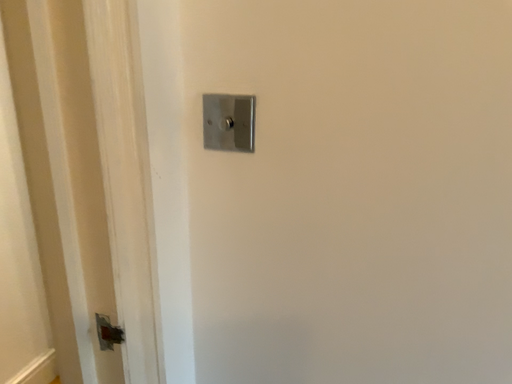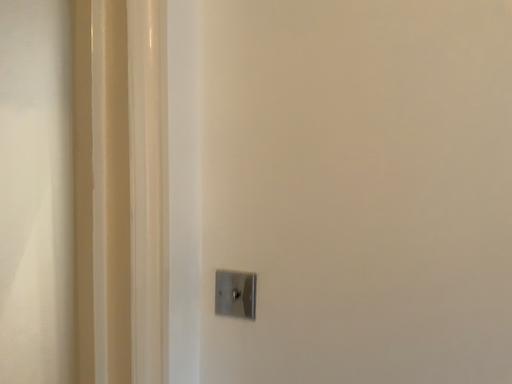
Question: How did the camera likely rotate when shooting the video?

Choices:
 (A) rotated downward
 (B) rotated upward

Answer: (B)